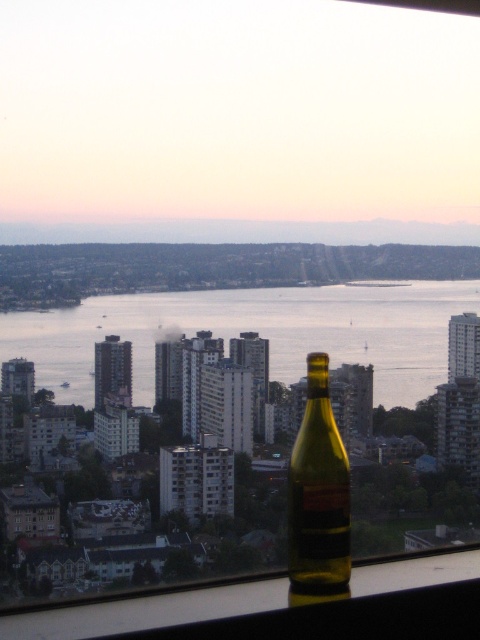
Does point (122, 308) lie behind point (47, 620)?

That is False.

Can you confirm if transparent glass water at center is thinner than transparent glass window sill at lower center?

Correct, transparent glass water at center's width is less than transparent glass window sill at lower center's.

Is point (149, 333) closer to camera compared to point (456, 588)?

Yes, it is.

Image resolution: width=480 pixels, height=640 pixels. Identify the location of transparent glass water at center. (253, 330).

Who is more forward, (427, 372) or (326, 442)?

Point (326, 442) is in front.

Who is lower down, transparent glass water at center or matte glass bottle at center?

Positioned lower is matte glass bottle at center.

Is point (301, 337) in front of point (344, 541)?

That is True.

Where is `transparent glass water at center`? transparent glass water at center is located at coordinates (253, 330).

Between transparent glass window sill at lower center and matte glass bottle at center, which one is positioned lower?

transparent glass window sill at lower center is lower down.

Can you confirm if transparent glass window sill at lower center is wider than matte glass bottle at center?

Yes.

The image size is (480, 640). I want to click on transparent glass window sill at lower center, so click(283, 605).

Find the location of a particular element. The width and height of the screenshot is (480, 640). transparent glass window sill at lower center is located at coordinates (283, 605).